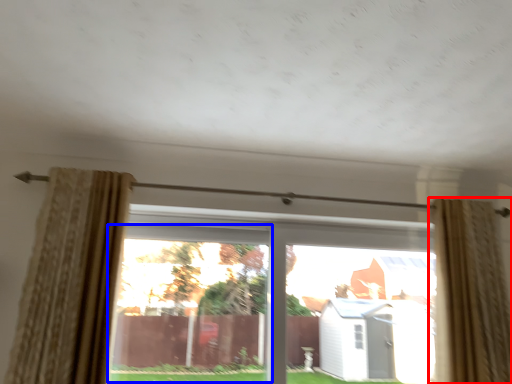
Question: Which of the following is the closest to the observer, curtain (highlighted by a red box) or window (highlighted by a blue box)?

Choices:
 (A) curtain
 (B) window

Answer: (A)